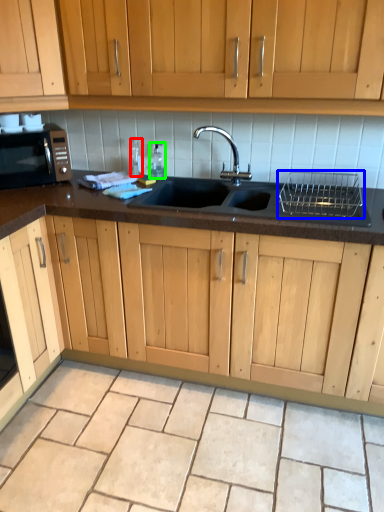
Question: Estimate the real-world distances between objects in this image. Which object is closer to bottle (highlighted by a red box), appliance (highlighted by a blue box) or bottle (highlighted by a green box)?

Choices:
 (A) appliance
 (B) bottle

Answer: (B)